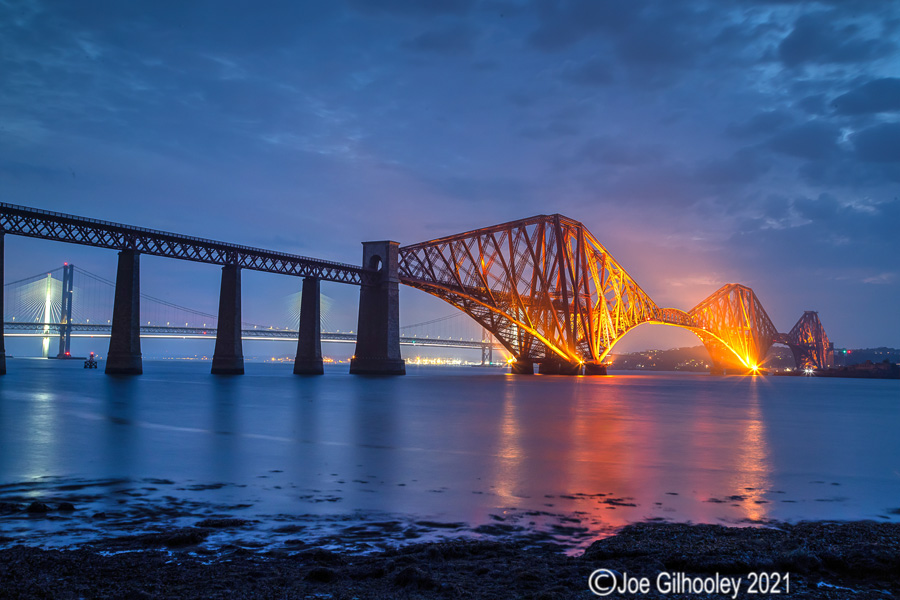
The width and height of the screenshot is (900, 600). Find the location of `lightbulb`. lightbulb is located at coordinates (48, 279).